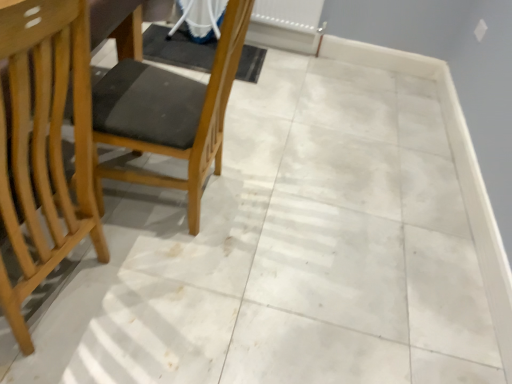
Find the location of `white plastic radiator at upper center`. white plastic radiator at upper center is located at coordinates (286, 24).

How much space does wooden chair at left, which appears as the 2th chair when viewed from the left, occupy vertically?

It is 37.25 inches.

You are a GUI agent. You are given a task and a screenshot of the screen. Output one action in this format:
    pyautogui.click(x=<x>, y=<y>)
    Task: Click on the light wood chair at left, which is counted as the first chair, starting from the left
    This screenshot has width=512, height=384.
    Given the screenshot: What is the action you would take?
    pyautogui.click(x=45, y=143)

In the scene shown: From a real-world perspective, which object stands above the other?

From a 3D spatial view, light wood chair at left, which is the second chair from right to left, is above.

Considering the relative sizes of white plastic radiator at upper center and light wood chair at left, which is counted as the first chair, starting from the left, in the image provided, is white plastic radiator at upper center wider than light wood chair at left, which is counted as the first chair, starting from the left,?

No, white plastic radiator at upper center is not wider than light wood chair at left, which is counted as the first chair, starting from the left.

Is there a large distance between light wood chair at left, which is the second chair from right to left, and wooden chair at left, which appears as the 2th chair when viewed from the left?

No, light wood chair at left, which is the second chair from right to left, is not far away from wooden chair at left, which appears as the 2th chair when viewed from the left.

Considering the positions of objects light wood chair at left, which is counted as the first chair, starting from the left, and wooden chair at left, positioned as the 1th chair in right-to-left order, in the image provided, who is more to the right, light wood chair at left, which is counted as the first chair, starting from the left, or wooden chair at left, positioned as the 1th chair in right-to-left order,?

wooden chair at left, positioned as the 1th chair in right-to-left order.

Is wooden chair at left, which appears as the 2th chair when viewed from the left, aimed at white plastic radiator at upper center?

No, wooden chair at left, which appears as the 2th chair when viewed from the left, is not facing towards white plastic radiator at upper center.

Which of these two, wooden chair at left, which appears as the 2th chair when viewed from the left, or white plastic radiator at upper center, is smaller?

white plastic radiator at upper center is smaller.

In the scene shown: Is white plastic radiator at upper center located within wooden chair at left, positioned as the 1th chair in right-to-left order?

Actually, white plastic radiator at upper center is outside wooden chair at left, positioned as the 1th chair in right-to-left order.

From the picture: Can you tell me how much wooden chair at left, positioned as the 1th chair in right-to-left order, and white plastic radiator at upper center differ in facing direction?

The facing directions of wooden chair at left, positioned as the 1th chair in right-to-left order, and white plastic radiator at upper center are 87.2 degrees apart.

Does white plastic radiator at upper center have a larger size compared to wooden chair at left, positioned as the 1th chair in right-to-left order?

No, white plastic radiator at upper center is not bigger than wooden chair at left, positioned as the 1th chair in right-to-left order.

Which of these two, white plastic radiator at upper center or wooden chair at left, positioned as the 1th chair in right-to-left order, stands taller?

With more height is wooden chair at left, positioned as the 1th chair in right-to-left order.

From the image's perspective, is white plastic radiator at upper center on wooden chair at left, positioned as the 1th chair in right-to-left order?

Yes, from the image's perspective, white plastic radiator at upper center is above wooden chair at left, positioned as the 1th chair in right-to-left order.

From a real-world perspective, which object stands above the other?

wooden chair at left, which appears as the 2th chair when viewed from the left, is physically above.

Where is `radiator behind the light wood chair at left, which is the second chair from right to left`? Image resolution: width=512 pixels, height=384 pixels. radiator behind the light wood chair at left, which is the second chair from right to left is located at coordinates (286, 24).

Between light wood chair at left, which is the second chair from right to left, and white plastic radiator at upper center, which one appears on the left side from the viewer's perspective?

From the viewer's perspective, light wood chair at left, which is the second chair from right to left, appears more on the left side.

From the image's perspective, is light wood chair at left, which is the second chair from right to left, under white plastic radiator at upper center?

Indeed, from the image's perspective, light wood chair at left, which is the second chair from right to left, is shown beneath white plastic radiator at upper center.

From the image's perspective, is wooden chair at left, which appears as the 2th chair when viewed from the left, on light wood chair at left, which is the second chair from right to left?

Yes, from the image's perspective, wooden chair at left, which appears as the 2th chair when viewed from the left, is over light wood chair at left, which is the second chair from right to left.

Which of these two, wooden chair at left, which appears as the 2th chair when viewed from the left, or light wood chair at left, which is counted as the first chair, starting from the left, is bigger?

light wood chair at left, which is counted as the first chair, starting from the left, is bigger.

Could you tell me if wooden chair at left, positioned as the 1th chair in right-to-left order, is turned towards light wood chair at left, which is the second chair from right to left?

No, wooden chair at left, positioned as the 1th chair in right-to-left order, is not facing towards light wood chair at left, which is the second chair from right to left.

Find the location of a particular element. chair on the left of the wooden chair at left, which appears as the 2th chair when viewed from the left is located at coordinates (45, 143).

Find the location of `radiator on the right of light wood chair at left, which is counted as the first chair, starting from the left`. radiator on the right of light wood chair at left, which is counted as the first chair, starting from the left is located at coordinates (286, 24).

Identify the location of chair that appears on the left of wooden chair at left, which appears as the 2th chair when viewed from the left. This screenshot has width=512, height=384. (45, 143).

Looking at the image, which one is located closer to light wood chair at left, which is the second chair from right to left, wooden chair at left, positioned as the 1th chair in right-to-left order, or white plastic radiator at upper center?

The object closer to light wood chair at left, which is the second chair from right to left, is wooden chair at left, positioned as the 1th chair in right-to-left order.

Looking at this image, based on their spatial positions, is white plastic radiator at upper center or wooden chair at left, which appears as the 2th chair when viewed from the left, further from light wood chair at left, which is counted as the first chair, starting from the left?

Among the two, white plastic radiator at upper center is located further to light wood chair at left, which is counted as the first chair, starting from the left.

From the image, which object appears to be nearer to wooden chair at left, which appears as the 2th chair when viewed from the left, light wood chair at left, which is the second chair from right to left, or white plastic radiator at upper center?

light wood chair at left, which is the second chair from right to left, lies closer to wooden chair at left, which appears as the 2th chair when viewed from the left, than the other object.

When comparing their distances from white plastic radiator at upper center, does wooden chair at left, positioned as the 1th chair in right-to-left order, or light wood chair at left, which is counted as the first chair, starting from the left, seem closer?

wooden chair at left, positioned as the 1th chair in right-to-left order, is positioned closer to the anchor white plastic radiator at upper center.

Which object lies further to the anchor point white plastic radiator at upper center, light wood chair at left, which is the second chair from right to left, or wooden chair at left, positioned as the 1th chair in right-to-left order?

Among the two, light wood chair at left, which is the second chair from right to left, is located further to white plastic radiator at upper center.

Which object lies nearer to the anchor point wooden chair at left, which appears as the 2th chair when viewed from the left, white plastic radiator at upper center or light wood chair at left, which is counted as the first chair, starting from the left?

light wood chair at left, which is counted as the first chair, starting from the left, lies closer to wooden chair at left, which appears as the 2th chair when viewed from the left, than the other object.

I want to click on chair located between light wood chair at left, which is the second chair from right to left, and white plastic radiator at upper center in the depth direction, so [169, 115].